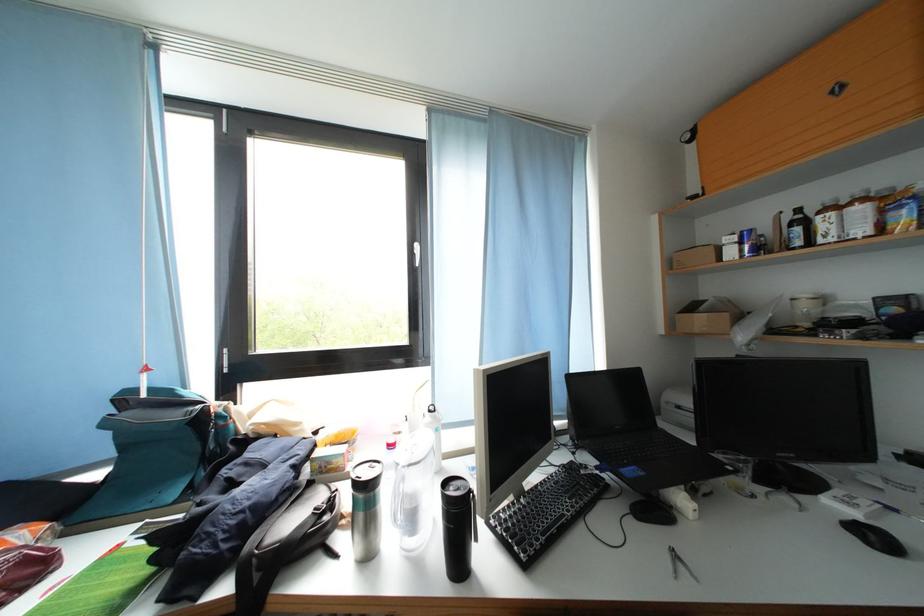
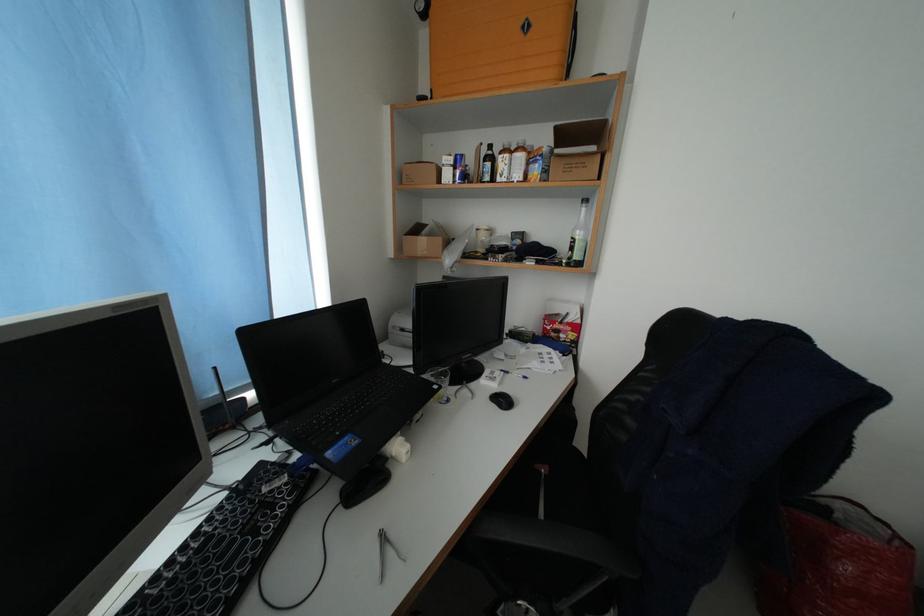
Locate, in the second image, the point that corresponds to point (796, 222) in the first image.

(492, 156)